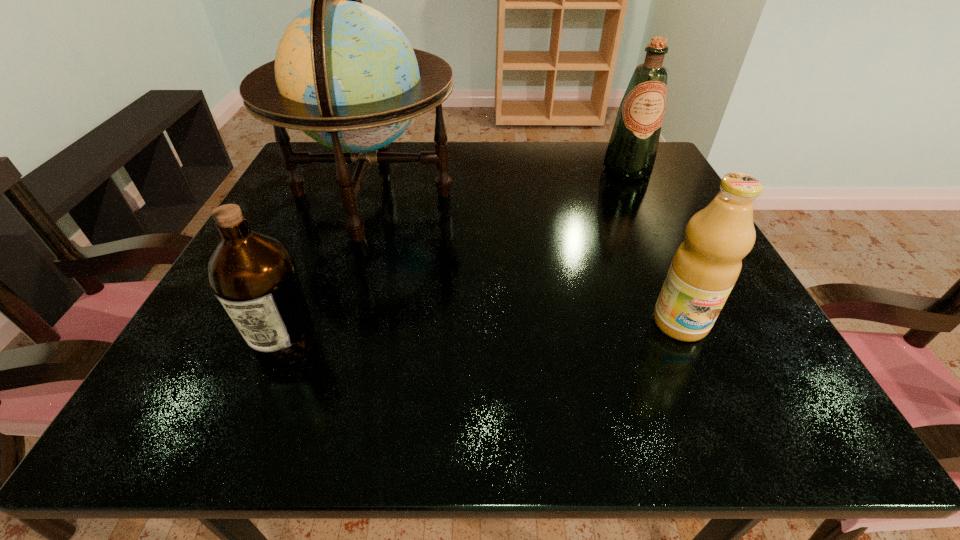
At what (x,y) coordinates should I click in order to perform the action: click on vacant space that satisfies the following two spatial constraints: 1. on the front-facing side of the farthest olive oil; 2. on the surface of the globe. Please return your answer as a coordinate pair (x, y). Looking at the image, I should click on (639, 194).

Find the location of a particular element. The width and height of the screenshot is (960, 540). free point that satisfies the following two spatial constraints: 1. on the front-facing side of the farthest olive oil; 2. on the surface of the tallest object is located at coordinates (639, 194).

Where is `vacant position in the image that satisfies the following two spatial constraints: 1. on the front-facing side of the farthest olive oil; 2. on the surface of the globe`? vacant position in the image that satisfies the following two spatial constraints: 1. on the front-facing side of the farthest olive oil; 2. on the surface of the globe is located at coordinates (639, 194).

In order to click on vacant region that satisfies the following two spatial constraints: 1. on the front-facing side of the farthest olive oil; 2. on the surface of the globe in this screenshot , I will do `click(639, 194)`.